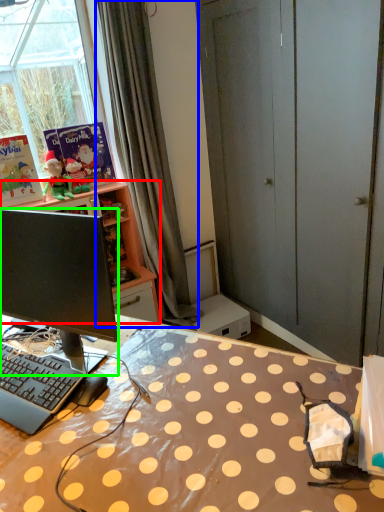
Question: Which object is positioned farthest from cabinetry (highlighted by a red box)? Select from curtain (highlighted by a blue box) and computer monitor (highlighted by a green box).

Choices:
 (A) curtain
 (B) computer monitor

Answer: (B)